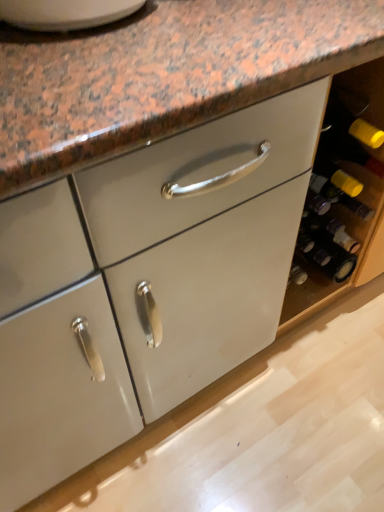
What are the coordinates of `matte glass wine bottle at right` in the screenshot? It's located at (326, 256).

Describe the element at coordinates (326, 256) in the screenshot. I see `matte glass wine bottle at right` at that location.

Identify the location of matte glass wine bottle at right. This screenshot has width=384, height=512. (326, 256).